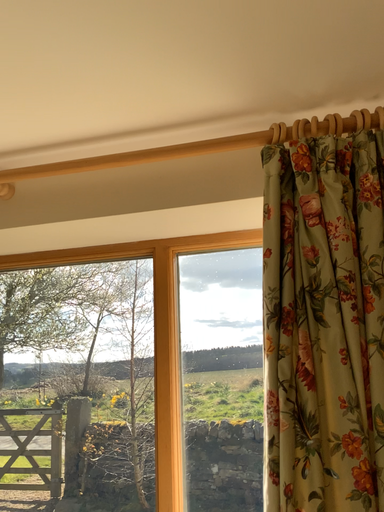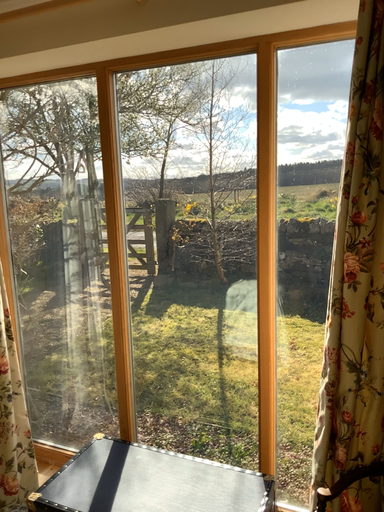
Question: Which way did the camera rotate in the video?

Choices:
 (A) rotated downward
 (B) rotated upward

Answer: (A)